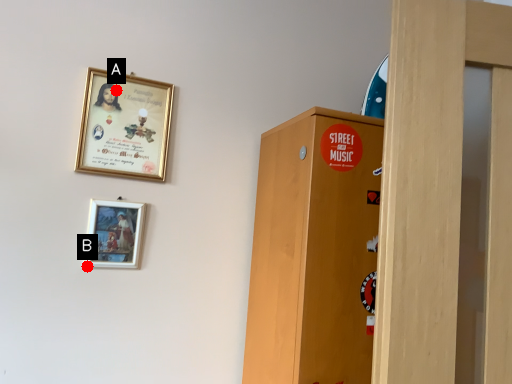
Question: Two points are circled on the image, labeled by A and B beside each circle. Which point is further to the camera?

Choices:
 (A) A is further
 (B) B is further

Answer: (A)